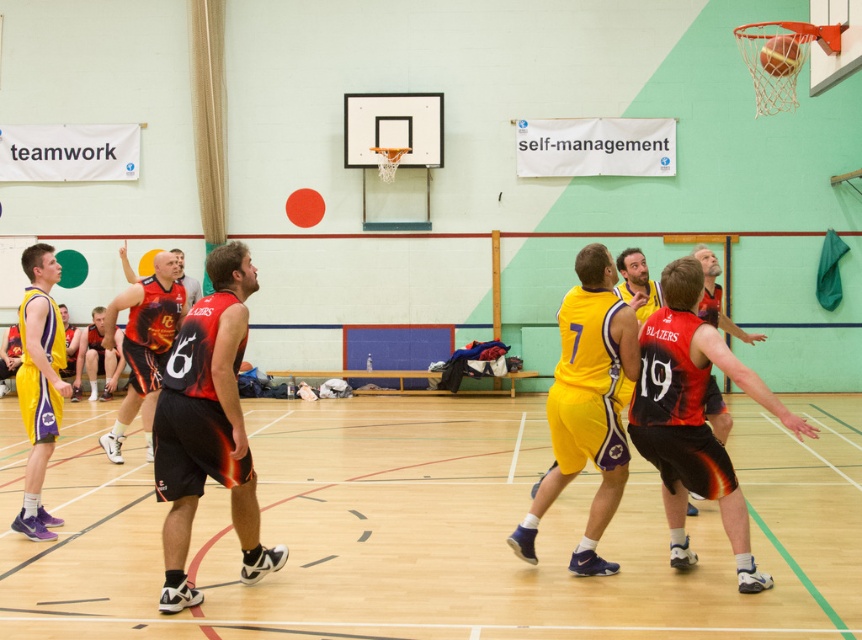
Question: Based on their relative distances, which object is nearer to the wooden floor at center?

Choices:
 (A) matte yellow jersey at left
 (B) red mesh jersey at center
 (C) reddish-black jersey at center

Answer: (C)

Question: Does reddish-orange jersey at center appear under red mesh jersey at center?

Choices:
 (A) yes
 (B) no

Answer: (B)

Question: Which point is farther to the camera?

Choices:
 (A) (211, 310)
 (B) (454, 460)

Answer: (B)

Question: Does matte red jersey at center lie behind matte yellow jersey at left?

Choices:
 (A) no
 (B) yes

Answer: (A)

Question: Does matte red jersey at center have a larger size compared to reddish-orange jersey at center?

Choices:
 (A) no
 (B) yes

Answer: (A)

Question: Which object is positioned closest to the reddish-black jersey at center?

Choices:
 (A) matte yellow jersey at left
 (B) matte red jersey at center
 (C) yellow matte shorts at center

Answer: (C)